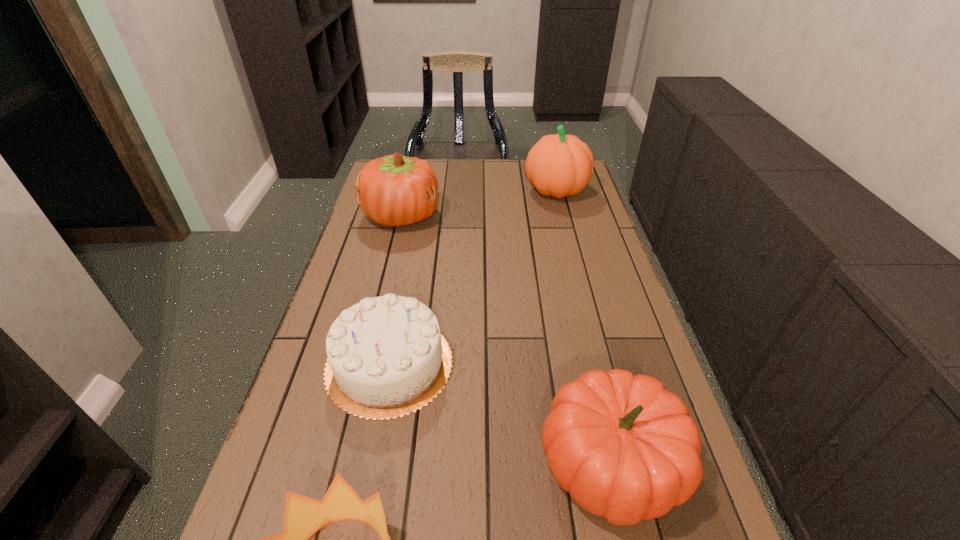
Locate which pumpkin ranks in proximity to the leftmost pumpkin. Please provide its 2D coordinates. Your answer should be formatted as a tuple, i.e. [(x, y)], where the tuple contains the x and y coordinates of a point satisfying the conditions above.

[(559, 165)]

Where is `free space in the image that satisfies the following two spatial constraints: 1. on the side of the leftmost pumpkin with the cute face; 2. on the right side of the birthday cake`? free space in the image that satisfies the following two spatial constraints: 1. on the side of the leftmost pumpkin with the cute face; 2. on the right side of the birthday cake is located at coordinates (366, 363).

Where is `free location that satisfies the following two spatial constraints: 1. on the side of the shortest pumpkin with the cute face; 2. on the left side of the leftmost pumpkin`? The width and height of the screenshot is (960, 540). free location that satisfies the following two spatial constraints: 1. on the side of the shortest pumpkin with the cute face; 2. on the left side of the leftmost pumpkin is located at coordinates (341, 463).

In order to click on free location that satisfies the following two spatial constraints: 1. on the side of the birthday cake with the cute face; 2. on the right side of the leftmost pumpkin in this screenshot , I will do `click(366, 363)`.

The width and height of the screenshot is (960, 540). What are the coordinates of `vacant region that satisfies the following two spatial constraints: 1. on the side of the leftmost pumpkin with the cute face; 2. on the left side of the birthday cake` in the screenshot? It's located at (366, 363).